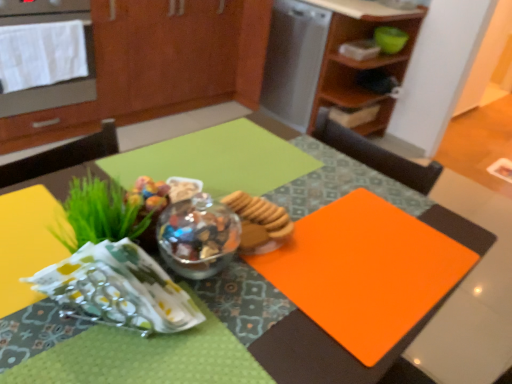
This screenshot has height=384, width=512. I want to click on free space to the back side of orange matte placemat at center, so click(338, 180).